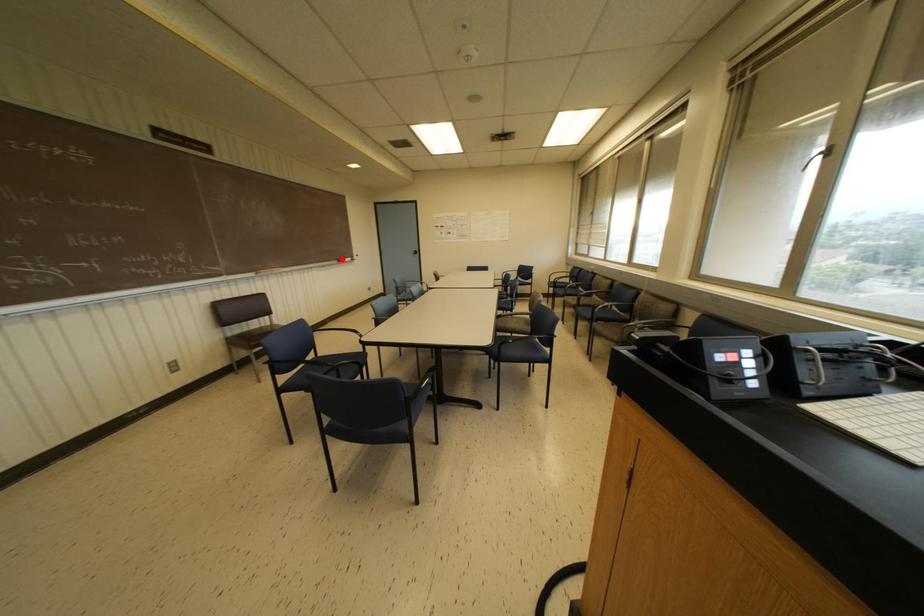
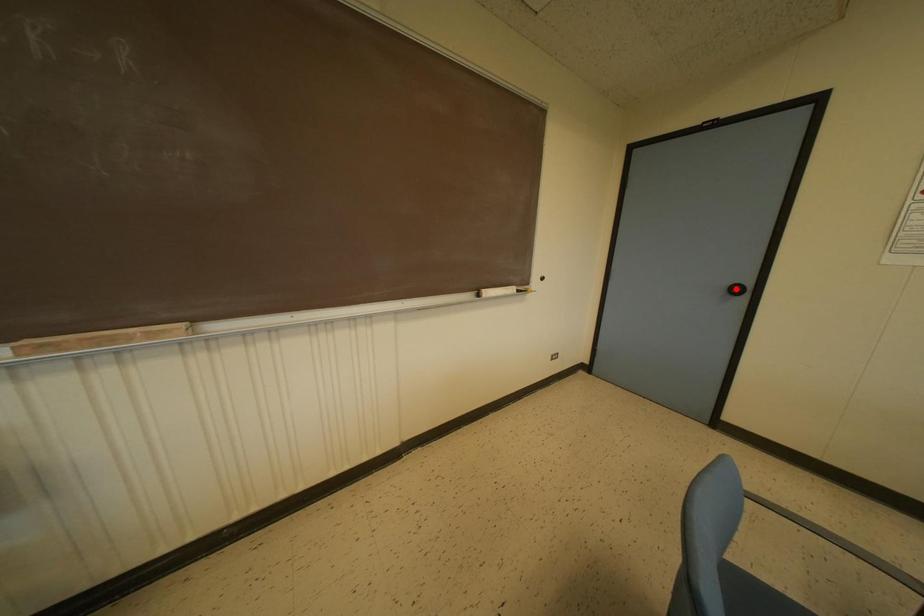
I am providing you with two images of the same scene from different viewpoints. A red point is marked on the first image and another point is marked on the second image. Does the point marked in image1 correspond to the same location as the one in image2?

No